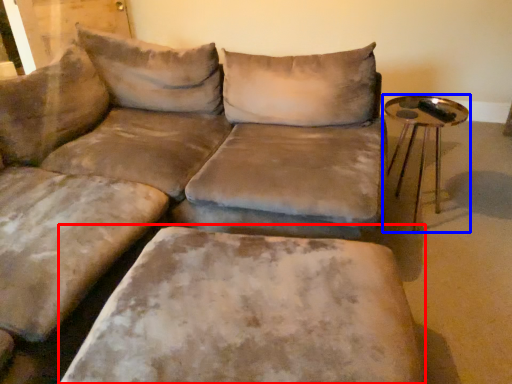
Question: Which object appears farthest to the camera in this image, swivel chair (highlighted by a red box) or table (highlighted by a blue box)?

Choices:
 (A) swivel chair
 (B) table

Answer: (B)